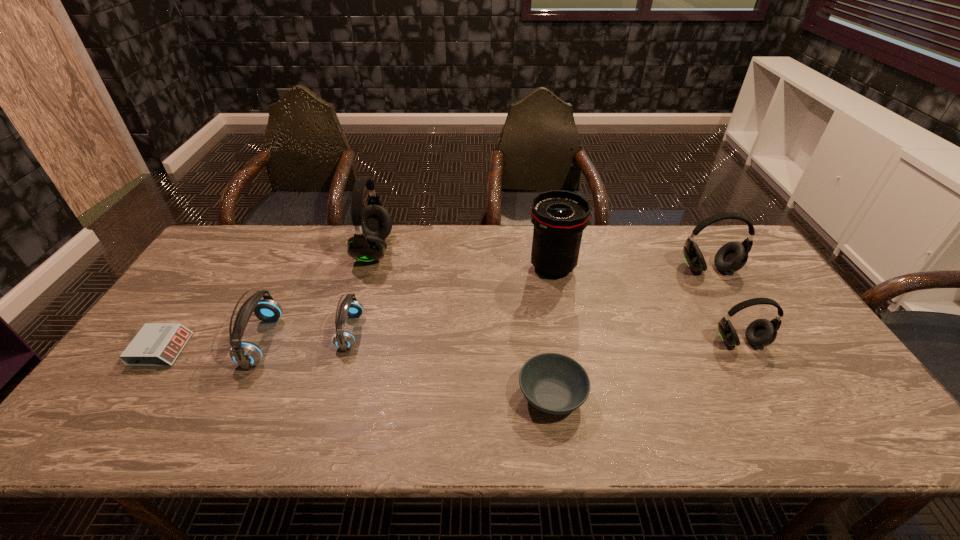
Image resolution: width=960 pixels, height=540 pixels. In order to click on the tallest headset in this screenshot , I will do `click(373, 223)`.

The height and width of the screenshot is (540, 960). Identify the location of the biggest black headset. (373, 223).

You are a GUI agent. You are given a task and a screenshot of the screen. Output one action in this format:
    pyautogui.click(x=<x>, y=<y>)
    Task: Click on the telephoto lens
    The width and height of the screenshot is (960, 540).
    Given the screenshot: What is the action you would take?
    pyautogui.click(x=559, y=217)

Locate an element on the screen. the second smallest black headset is located at coordinates (731, 257).

Image resolution: width=960 pixels, height=540 pixels. Find the location of `the nearest black headset`. the nearest black headset is located at coordinates (761, 332).

Identify the location of the bigger blue headset. (246, 354).

Where is `the leftmost headset`? Image resolution: width=960 pixels, height=540 pixels. the leftmost headset is located at coordinates (246, 354).

Locate an element on the screen. The image size is (960, 540). the smaller blue headset is located at coordinates (350, 307).

You are a GUI agent. You are given a task and a screenshot of the screen. Output one action in this format:
    pyautogui.click(x=<x>, y=<y>)
    Task: Click on the third shortest object
    The width and height of the screenshot is (960, 540).
    Given the screenshot: What is the action you would take?
    pyautogui.click(x=350, y=307)

The width and height of the screenshot is (960, 540). In order to click on the seventh tallest object in this screenshot , I will do `click(553, 383)`.